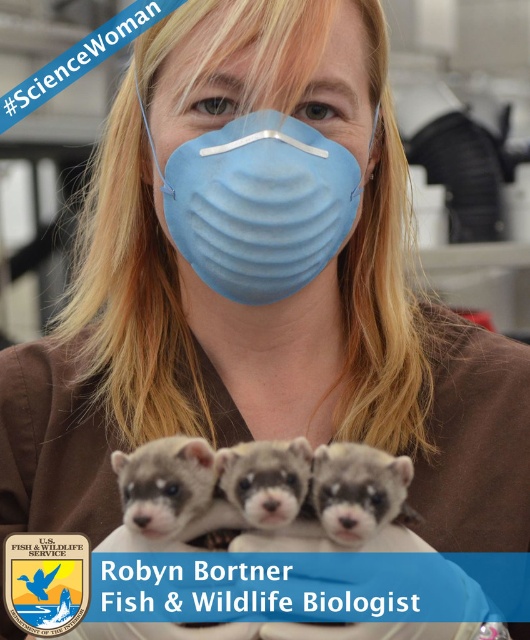
Can you confirm if fuzzy gray ferret at center is wider than fuzzy white ferret at center?

Yes, fuzzy gray ferret at center is wider than fuzzy white ferret at center.

Is fuzzy gray ferret at center to the left of fuzzy white ferret at center from the viewer's perspective?

No, fuzzy gray ferret at center is not to the left of fuzzy white ferret at center.

Measure the distance between fuzzy gray ferret at center and camera.

They are 35.88 inches apart.

At what (x,y) coordinates should I click in order to perform the action: click on fuzzy gray ferret at center. Please return your answer as a coordinate pair (x, y). The height and width of the screenshot is (640, 530). Looking at the image, I should click on (358, 490).

Locate an element on the screen. The image size is (530, 640). blue non-woven fabric mask at center is located at coordinates (259, 204).

Does blue non-woven fabric mask at center appear over fuzzy white ferret at center?

Indeed, blue non-woven fabric mask at center is positioned over fuzzy white ferret at center.

Between point (173, 156) and point (188, 492), which one is positioned in front?

Point (188, 492) is in front.

Find the location of `blue non-woven fabric mask at center`. blue non-woven fabric mask at center is located at coordinates (259, 204).

Locate an element on the screen. The height and width of the screenshot is (640, 530). blue non-woven fabric mask at center is located at coordinates (259, 204).

Is blue non-woven fabric mask at center further to camera compared to fuzzy gray ferret at center?

Yes, it is behind fuzzy gray ferret at center.

Where is `blue non-woven fabric mask at center`? This screenshot has height=640, width=530. blue non-woven fabric mask at center is located at coordinates (259, 204).